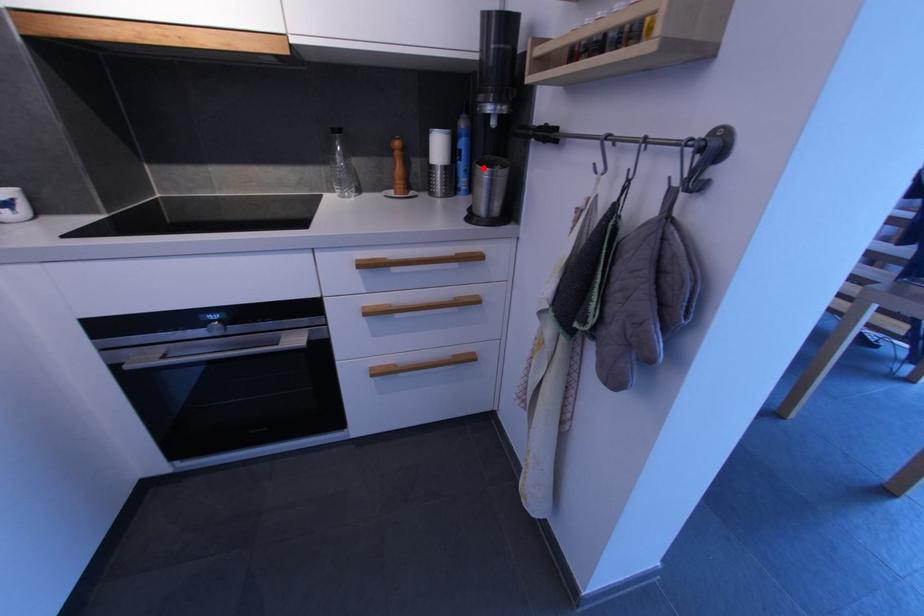
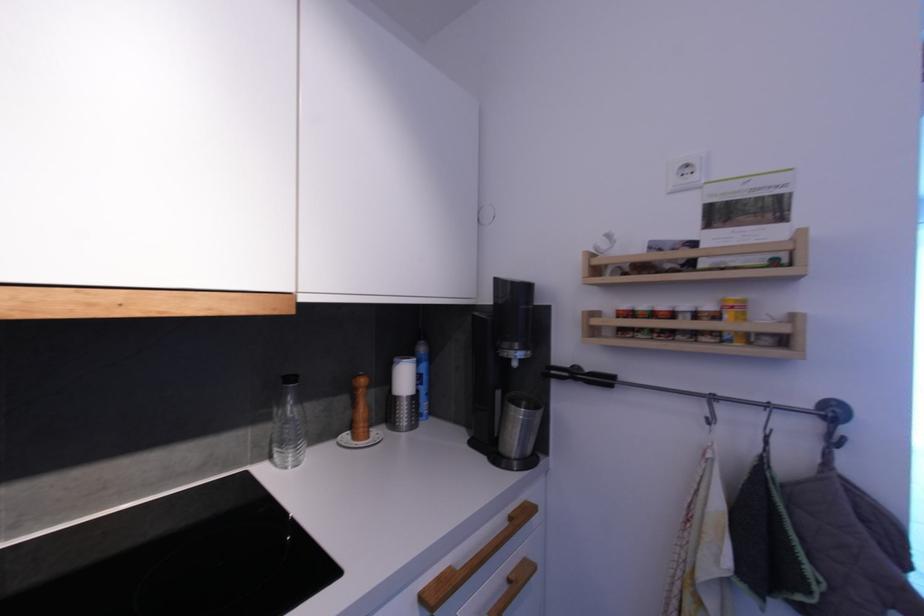
Question: I am providing you with two images of the same scene from different viewpoints. A red point is marked on the first image. Can you still see the location of the red point in image 2?

Choices:
 (A) Yes
 (B) No

Answer: (A)